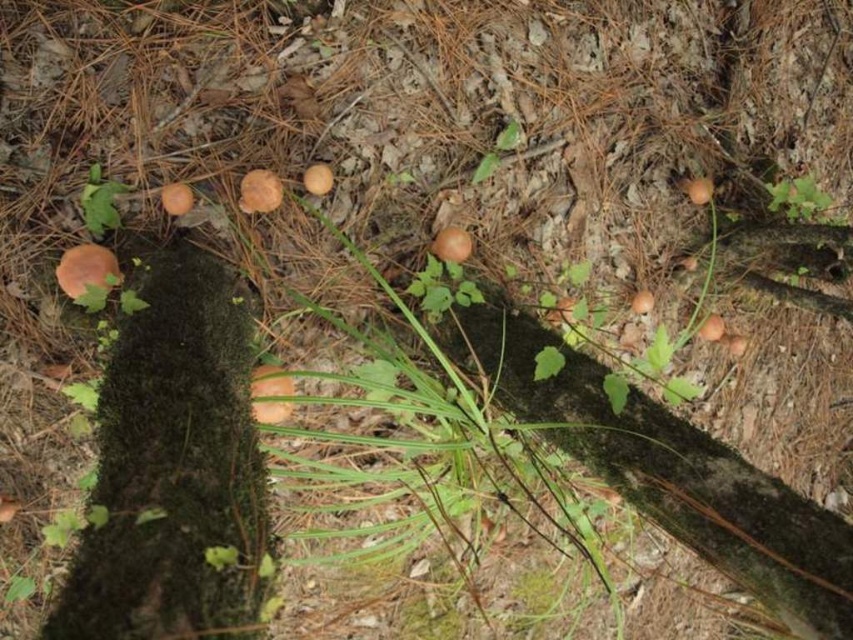
Is green mossy tree trunk at left taller than brown matte mushroom at center?

Correct, green mossy tree trunk at left is much taller as brown matte mushroom at center.

Identify the location of green mossy tree trunk at left. (173, 468).

Where is `green mossy tree trunk at left`? This screenshot has width=853, height=640. green mossy tree trunk at left is located at coordinates (173, 468).